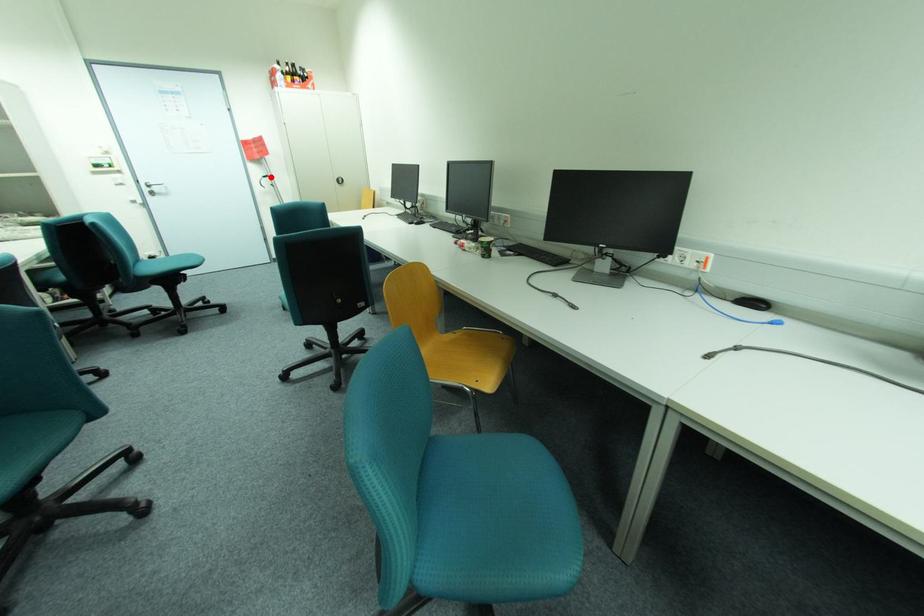
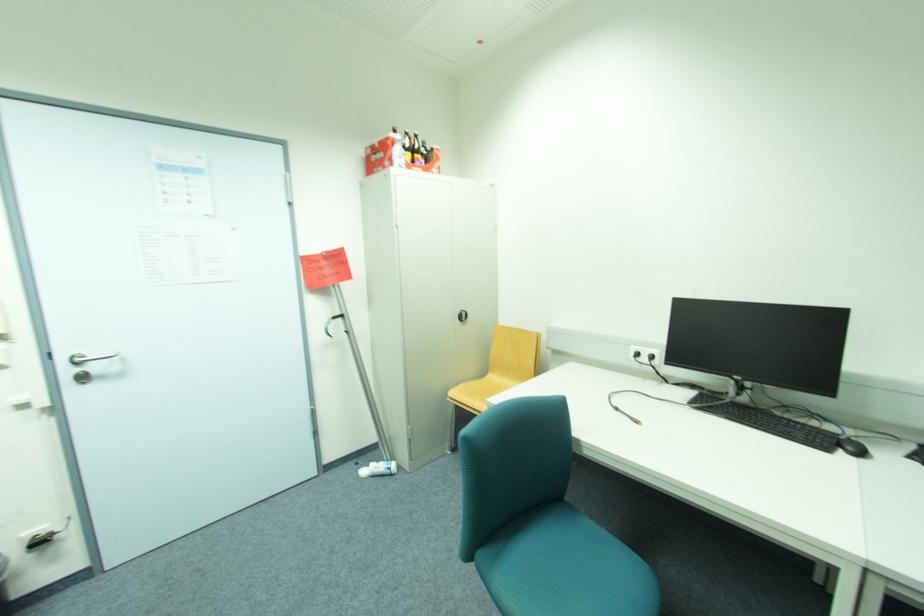
Question: A red point is marked in image1. In image2, is the corresponding 3D point closer to the camera or farther? Reply with the corresponding letter.

Choices:
 (A) The corresponding 3D point is closer.
 (B) The corresponding 3D point is farther.

Answer: (B)